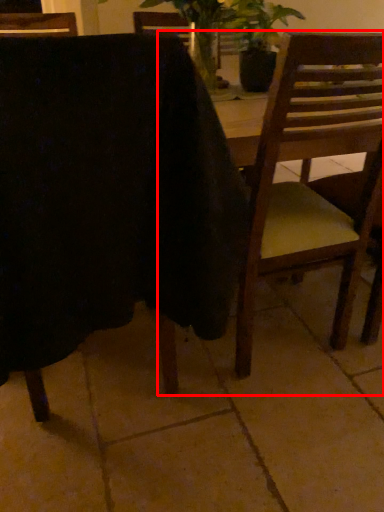
Question: From the image's perspective, what is the correct spatial relationship of chair (annotated by the red box) in relation to chair?

Choices:
 (A) below
 (B) above

Answer: (A)